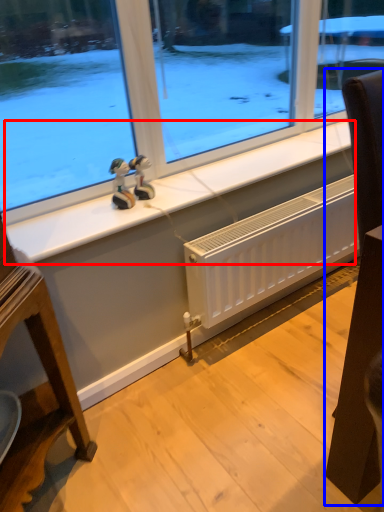
Question: Which object is further to the camera taking this photo, window sill (highlighted by a red box) or furniture (highlighted by a blue box)?

Choices:
 (A) window sill
 (B) furniture

Answer: (A)